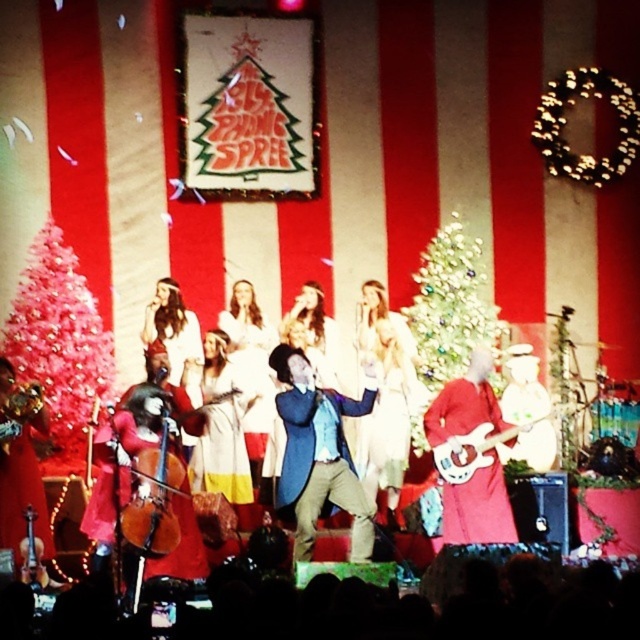
Question: Among these points, which one is farthest from the camera?

Choices:
 (A) (145, 531)
 (B) (147, 436)
 (C) (429, 330)

Answer: (C)

Question: Is green glittery christmas tree at center positioned at the back of shiny red dress at center?

Choices:
 (A) no
 (B) yes

Answer: (B)

Question: Which point is closer to the camera?

Choices:
 (A) (195, 381)
 (B) (381, 483)
 (C) (531, 364)
 (D) (442, 362)

Answer: (B)

Question: Is red velvet guitar at center thinner than white fabric dress at center?

Choices:
 (A) no
 (B) yes

Answer: (A)

Question: Is shiny pink christmas tree at left below matte blue suit at center?

Choices:
 (A) yes
 (B) no

Answer: (B)

Question: Which object is the closest to the matte blue suit at center?

Choices:
 (A) shiny pink christmas tree at left
 (B) velvet red cello at lower left
 (C) brown wooden cello at lower left

Answer: (C)